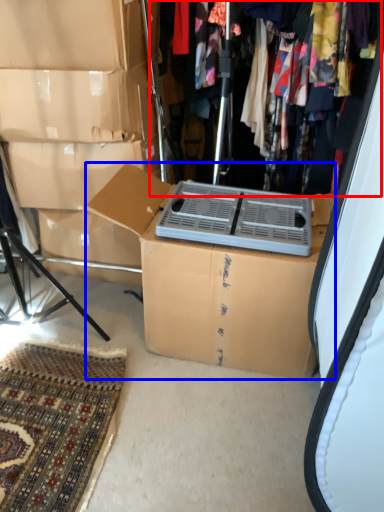
Question: Which point is further to the camera, closet (highlighted by a red box) or box (highlighted by a blue box)?

Choices:
 (A) closet
 (B) box

Answer: (A)